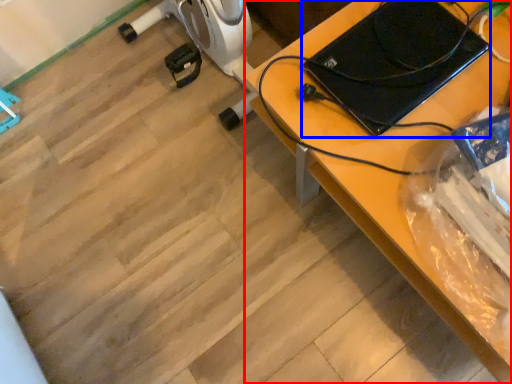
Question: Among these objects, which one is farthest to the camera, desk (highlighted by a red box) or laptop (highlighted by a blue box)?

Choices:
 (A) desk
 (B) laptop

Answer: (B)